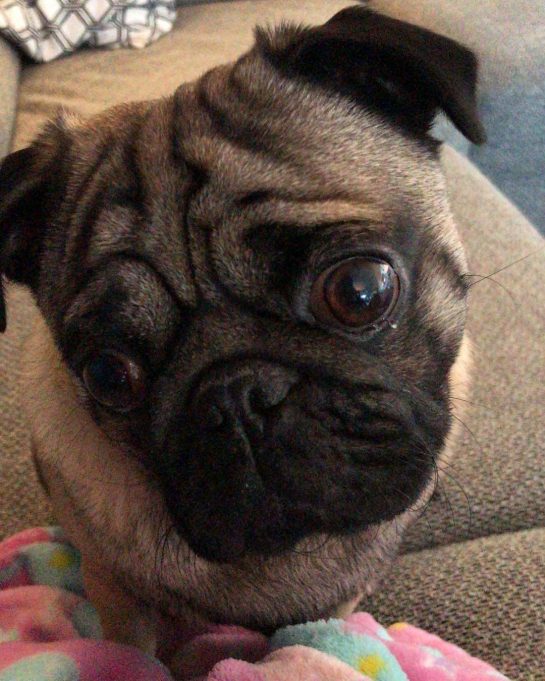
Locate an element on the screen. This screenshot has height=681, width=545. floor is located at coordinates (524, 124).